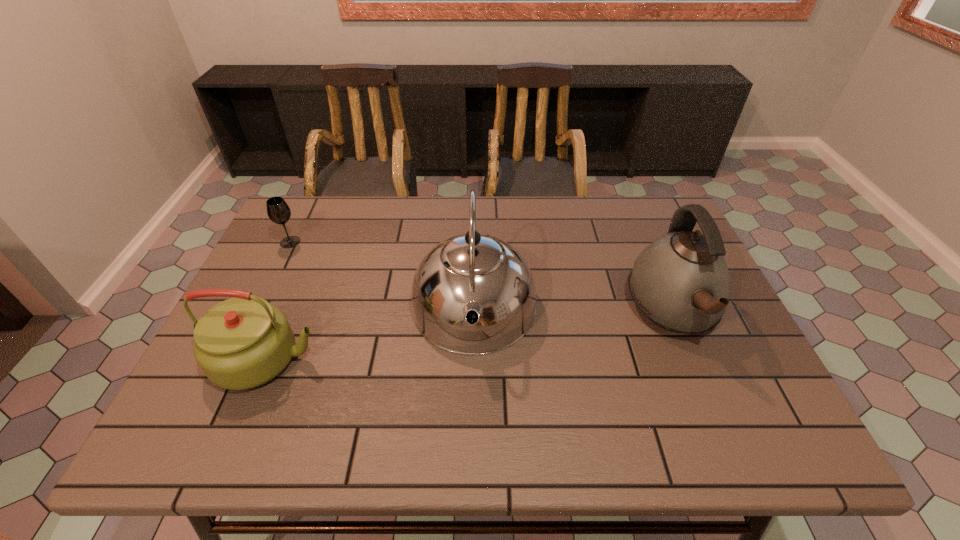
Locate an element on the screen. free spot at the far left corner of the desktop is located at coordinates (298, 199).

I want to click on vacant space at the near left corner of the desktop, so click(197, 433).

The width and height of the screenshot is (960, 540). Identify the location of empty space between the third tallest object and the wineglass. (x=278, y=300).

Find the location of a particular element. empty space between the third object from left to right and the second shortest kettle is located at coordinates (573, 310).

In order to click on free point between the leftmost kettle and the wineglass in this screenshot , I will do `click(278, 300)`.

Find the location of a particular element. vacant area between the third object from left to right and the shortest kettle is located at coordinates (371, 334).

Where is `vacant space that is in between the second kettle from right to left and the wineglass`? Image resolution: width=960 pixels, height=540 pixels. vacant space that is in between the second kettle from right to left and the wineglass is located at coordinates (382, 276).

This screenshot has height=540, width=960. Find the location of `vacant area that lies between the shortest object and the second shortest object`. vacant area that lies between the shortest object and the second shortest object is located at coordinates (278, 300).

Find the location of a particular element. The height and width of the screenshot is (540, 960). free area in between the wineglass and the third object from left to right is located at coordinates (382, 276).

I want to click on empty space between the second object from right to left and the shortest object, so click(x=382, y=276).